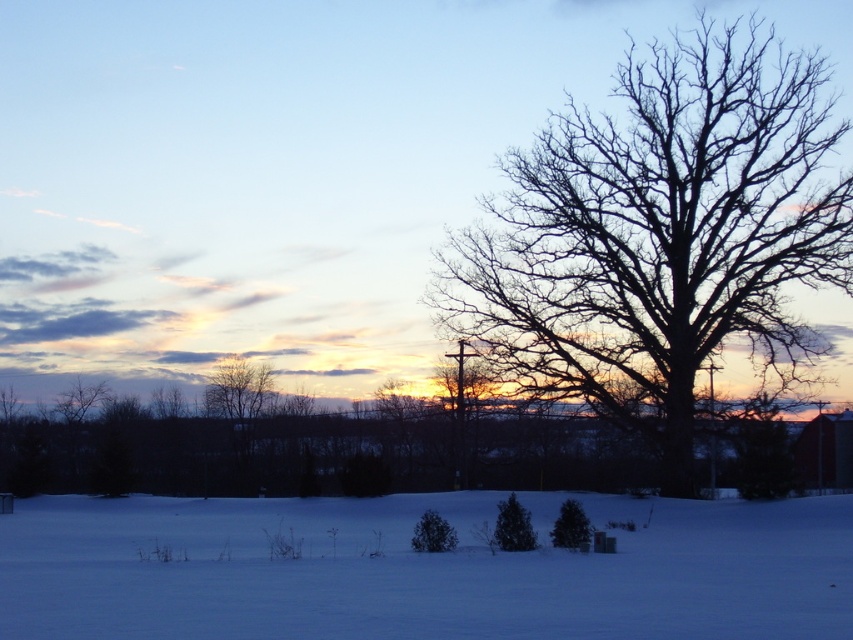
Is green matte evergreen tree at center above green matte evergreen at lower center?

Yes, green matte evergreen tree at center is above green matte evergreen at lower center.

Does point (566, 525) come behind point (440, 529)?

Yes, it is.

At what (x,y) coordinates should I click in order to perform the action: click on green matte evergreen tree at center. Please return your answer as a coordinate pair (x, y). Image resolution: width=853 pixels, height=640 pixels. Looking at the image, I should click on (570, 525).

Between white powdery snow at lower center and green matte evergreen tree at center, which one has less height?

With less height is green matte evergreen tree at center.

The width and height of the screenshot is (853, 640). Describe the element at coordinates (421, 572) in the screenshot. I see `white powdery snow at lower center` at that location.

Locate an element on the screen. This screenshot has width=853, height=640. white powdery snow at lower center is located at coordinates (421, 572).

Can you confirm if black bare tree at right is thinner than green matte evergreen tree at center?

No.

Does black bare tree at right have a greater height compared to green matte evergreen tree at center?

Yes.

Does point (732, 156) lie in front of point (553, 545)?

That is False.

The height and width of the screenshot is (640, 853). I want to click on black bare tree at right, so click(x=660, y=234).